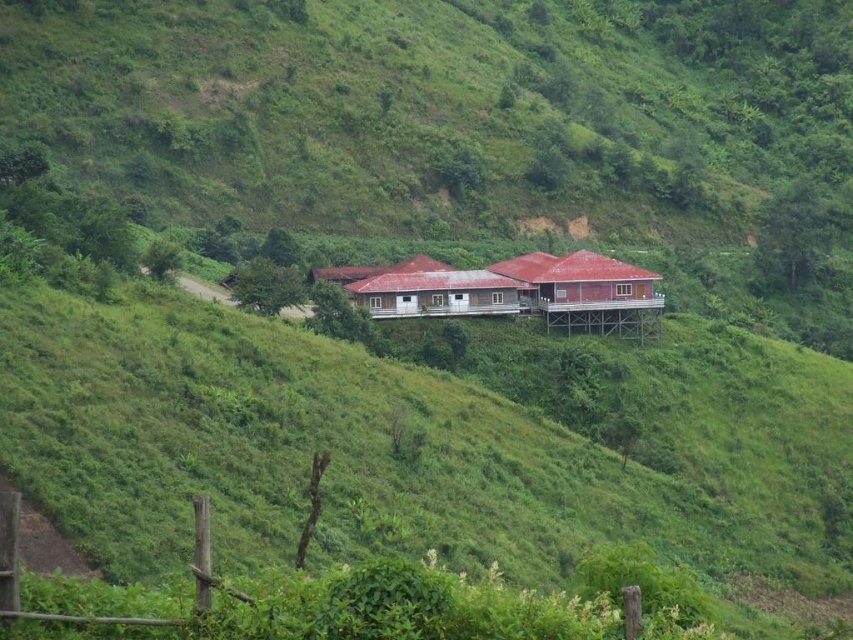
You are standing at the bottom of the hill and see the wooden hut at center and the brown wooden house at center. Which structure is closer to you?

The wooden hut at center is closer to you because it is in front of the brown wooden house at center.